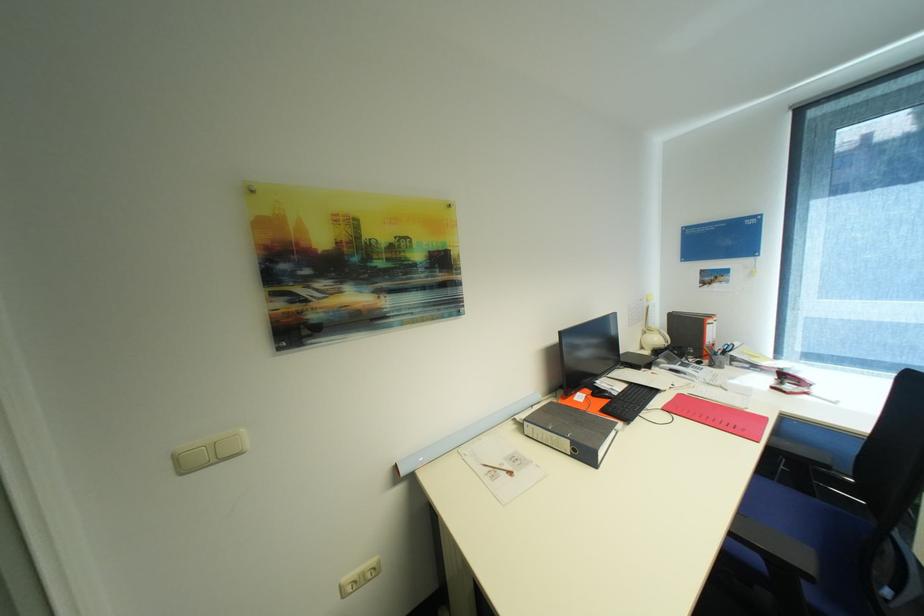
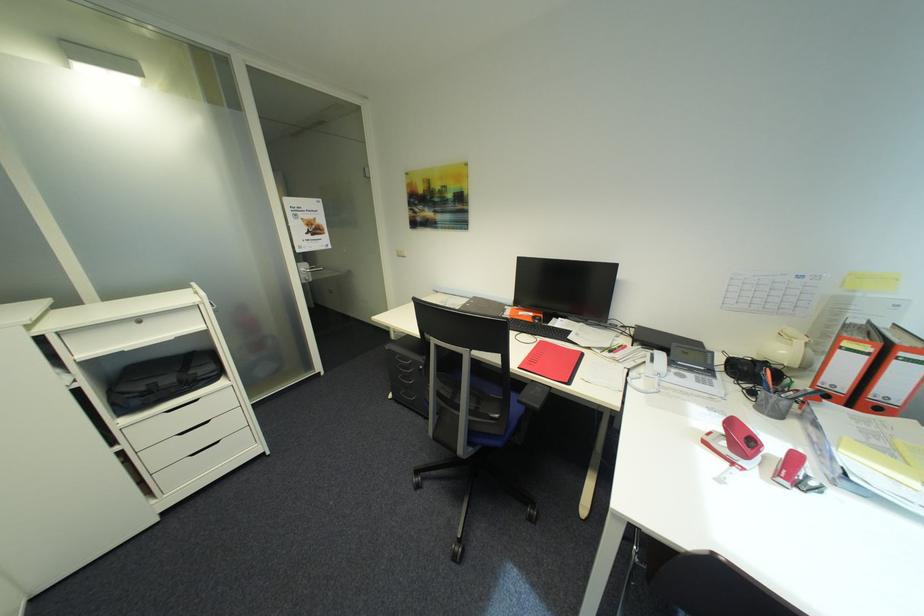
In the second image, find the point that corresponds to (x=813, y=394) in the first image.

(742, 464)